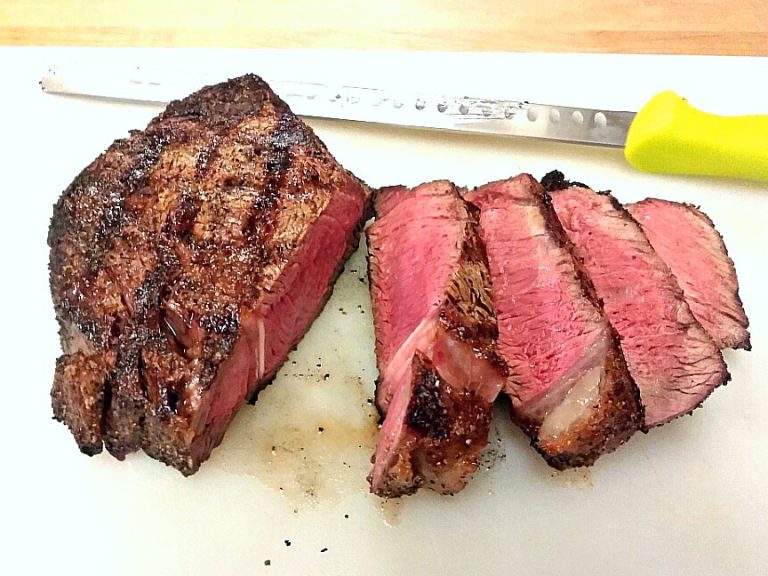
I want to click on burnt wall, so click(154, 289), click(131, 180), click(425, 403), click(280, 145), click(551, 177), click(568, 458), click(571, 21).